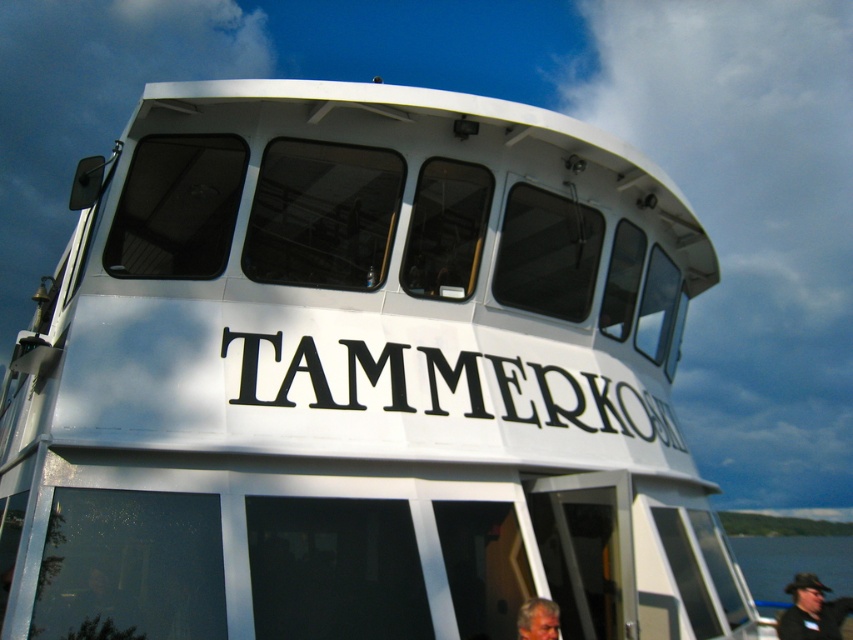
Question: Which point is farther to the camera?

Choices:
 (A) blue water at lower right
 (B) black fabric hat at lower right
 (C) blackmaterial/texturetammerkoski at center

Answer: (A)

Question: Which point is closer to the camera?

Choices:
 (A) (540, 627)
 (B) (790, 586)
 (C) (492, 404)
 (D) (776, 545)

Answer: (A)

Question: Can you confirm if blue water at lower right is smaller than black fabric hat at lower right?

Choices:
 (A) no
 (B) yes

Answer: (A)

Question: Which point is farther from the camera taking this photo?

Choices:
 (A) (291, 349)
 (B) (553, 605)
 (C) (807, 536)

Answer: (C)

Question: Can you confirm if blue water at lower right is positioned above black fabric hat at lower right?

Choices:
 (A) yes
 (B) no

Answer: (B)

Question: Where is blue water at lower right located in relation to gray hair at lower center in the image?

Choices:
 (A) left
 (B) right

Answer: (B)